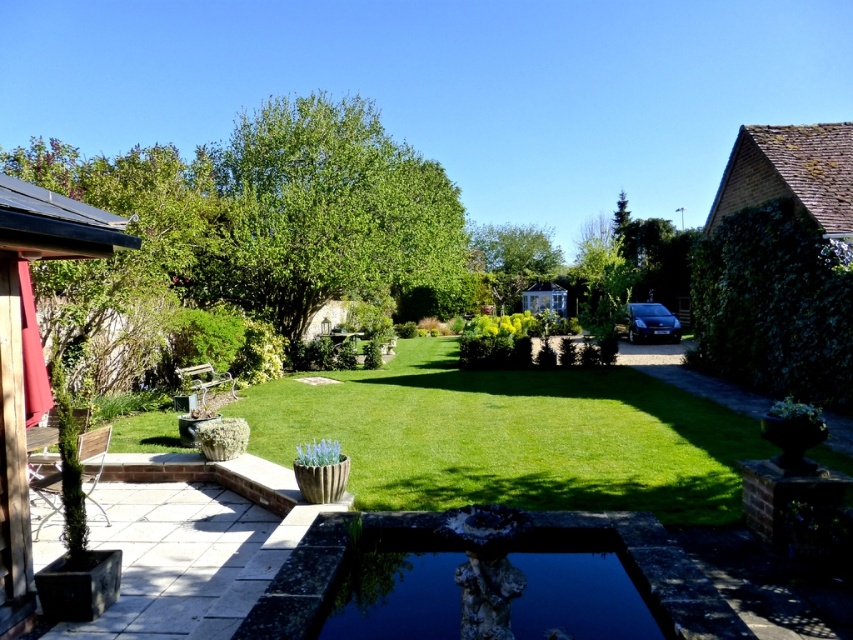
You are standing on the lawn and want to reach the dark stone water at center. Which direction should you walk to get there?

You should walk towards the center of the garden to reach the dark stone water at center.